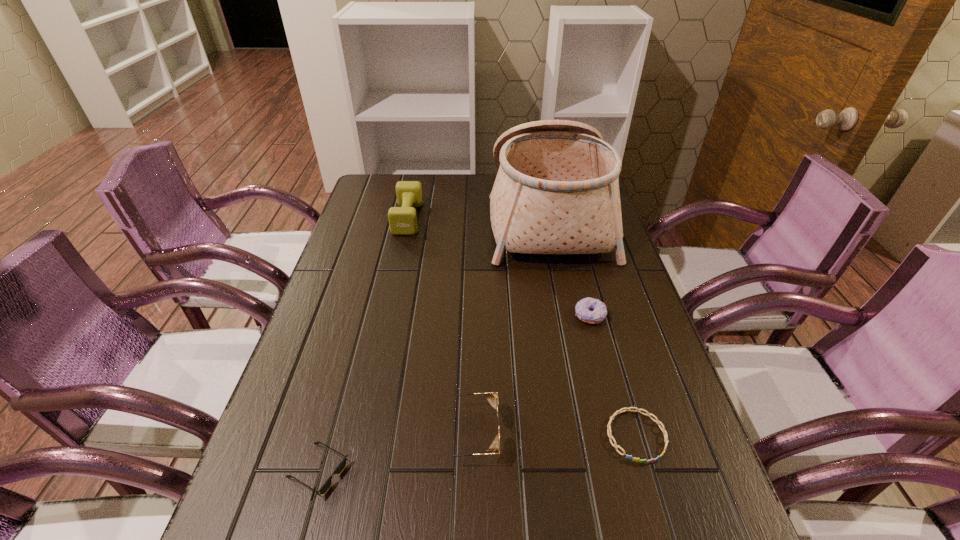
This screenshot has width=960, height=540. In order to click on sunglasses that is at the left edge in this screenshot , I will do `click(342, 465)`.

This screenshot has width=960, height=540. In order to click on basket positioned at the right edge in this screenshot , I will do `click(557, 190)`.

The height and width of the screenshot is (540, 960). In order to click on doughnut located in the right edge section of the desktop in this screenshot , I will do `click(598, 312)`.

I want to click on bracelet that is at the right edge, so click(657, 421).

Locate an element on the screen. The height and width of the screenshot is (540, 960). object present at the far left corner is located at coordinates (402, 220).

What are the coordinates of `object that is at the far right corner` in the screenshot? It's located at (557, 190).

This screenshot has width=960, height=540. I want to click on vacant space at the far edge of the desktop, so click(x=422, y=187).

In the image, there is a desktop. Where is `free space at the left edge`? Image resolution: width=960 pixels, height=540 pixels. free space at the left edge is located at coordinates (351, 220).

Locate an element on the screen. free space at the right edge of the desktop is located at coordinates (601, 279).

Identify the location of free space at the far left corner of the desktop. (377, 193).